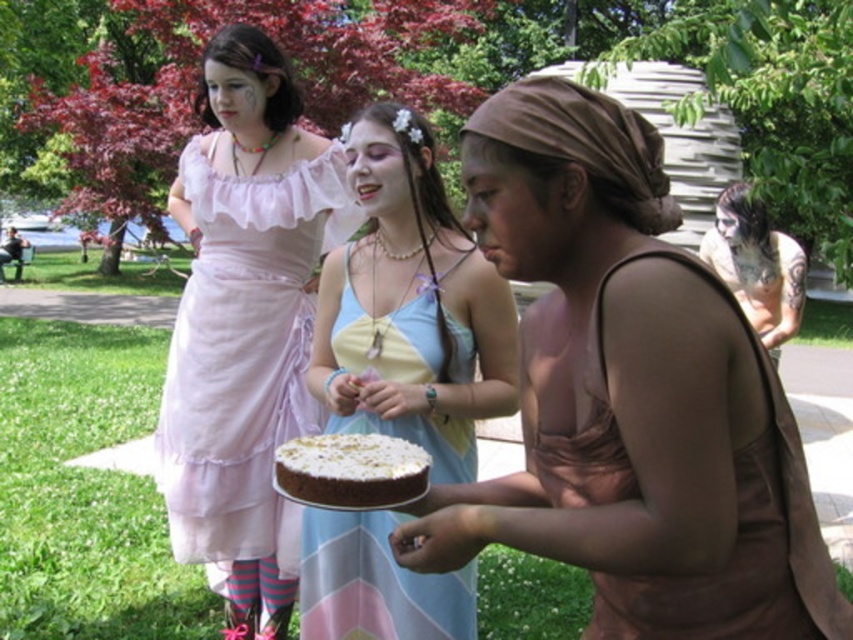
Question: In this image, where is light blue satin dress at center located relative to shiny silver hair at upper right?

Choices:
 (A) below
 (B) above

Answer: (A)

Question: Is brown matte dress at center smaller than shiny silver hair at upper right?

Choices:
 (A) yes
 (B) no

Answer: (A)

Question: Among these objects, which one is farthest from the camera?

Choices:
 (A) shiny silver hair at upper right
 (B) light blue satin dress at center
 (C) white frosted chocolate cake at center
 (D) brown satin dress at center

Answer: (A)

Question: Can you confirm if brown matte dress at center is positioned to the right of light blue satin dress at center?

Choices:
 (A) no
 (B) yes

Answer: (B)

Question: Among these objects, which one is farthest from the camera?

Choices:
 (A) brown matte dress at center
 (B) pastel pink chiffon dress at upper left
 (C) shiny silver hair at upper right

Answer: (C)

Question: Estimate the real-world distances between objects in this image. Which object is farther from the brown satin dress at center?

Choices:
 (A) shiny silver hair at upper right
 (B) brown matte dress at center

Answer: (A)